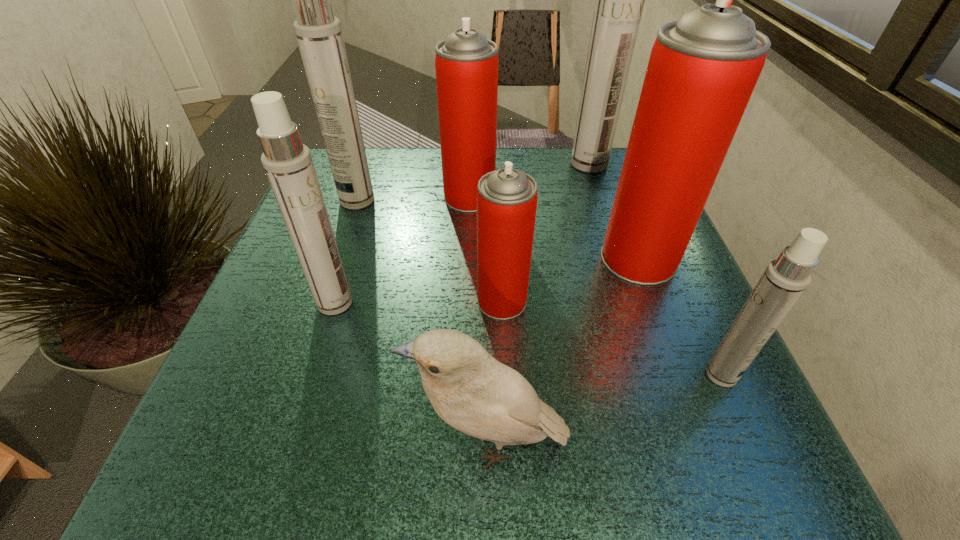
The image size is (960, 540). I want to click on bird, so click(470, 390).

Find the location of a particular element. Image resolution: width=960 pixels, height=540 pixels. free space located 0.120m on the left of the biggest white aerosol can is located at coordinates (521, 164).

This screenshot has height=540, width=960. What are the coordinates of `free region located on the right of the third nearest white aerosol can` in the screenshot? It's located at (469, 200).

Where is `vacant area situated on the left of the rightmost red aerosol can`? The image size is (960, 540). vacant area situated on the left of the rightmost red aerosol can is located at coordinates (486, 259).

This screenshot has width=960, height=540. Find the location of `free spot located 0.360m on the right of the second smallest red aerosol can`. free spot located 0.360m on the right of the second smallest red aerosol can is located at coordinates (657, 197).

The width and height of the screenshot is (960, 540). I want to click on vacant space located 0.160m on the back of the second smallest white aerosol can, so click(x=357, y=233).

Where is `free region located on the left of the smallest red aerosol can`? The height and width of the screenshot is (540, 960). free region located on the left of the smallest red aerosol can is located at coordinates (408, 301).

Locate an element on the screen. This screenshot has width=960, height=540. free space located 0.230m on the back of the nearest white aerosol can is located at coordinates (670, 260).

Locate an element on the screen. Image resolution: width=960 pixels, height=540 pixels. free spot located 0.260m at the beak of the white bird is located at coordinates (215, 443).

Image resolution: width=960 pixels, height=540 pixels. Find the location of `vacant space located 0.060m at the beak of the white bird`. vacant space located 0.060m at the beak of the white bird is located at coordinates (366, 443).